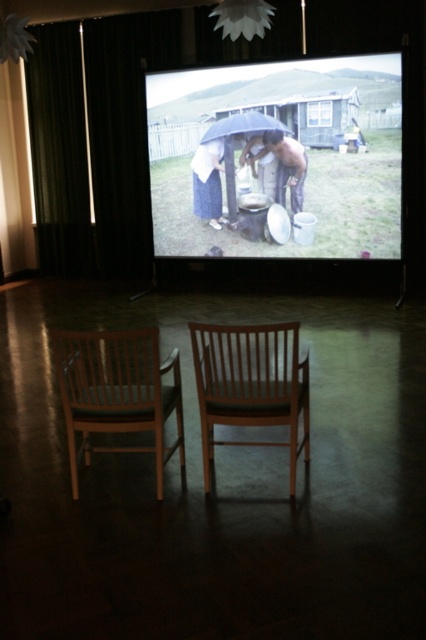
Does matte black umbrella at center appear on the left side of black matte umbrella at center?

Incorrect, matte black umbrella at center is not on the left side of black matte umbrella at center.

Between matte black umbrella at center and black matte umbrella at center, which one is positioned lower?

matte black umbrella at center is lower down.

Does point (253, 253) lie behind point (267, 116)?

That is True.

Image resolution: width=426 pixels, height=640 pixels. What are the coordinates of `matte black umbrella at center` in the screenshot? It's located at (279, 156).

Between matte black umbrella at center and wooden chair at lower left, which one is positioned lower?

Positioned lower is wooden chair at lower left.

Between matte black umbrella at center and wooden chair at lower left, which one has less height?

With less height is wooden chair at lower left.

The height and width of the screenshot is (640, 426). Identify the location of matte black umbrella at center. (279, 156).

Who is more distant from viewer, (141, 394) or (252, 113)?

The point (252, 113) is more distant.

Who is shorter, wooden chair at lower left or black matte umbrella at center?

black matte umbrella at center

Does point (144, 384) come behind point (226, 132)?

No, it is in front of (226, 132).

The height and width of the screenshot is (640, 426). I want to click on wooden chair at lower left, so click(x=118, y=392).